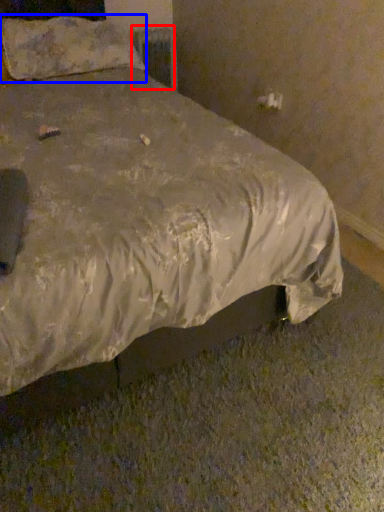
Question: Which object appears farthest to the camera in this image, radiator (highlighted by a red box) or pillow (highlighted by a blue box)?

Choices:
 (A) radiator
 (B) pillow

Answer: (A)